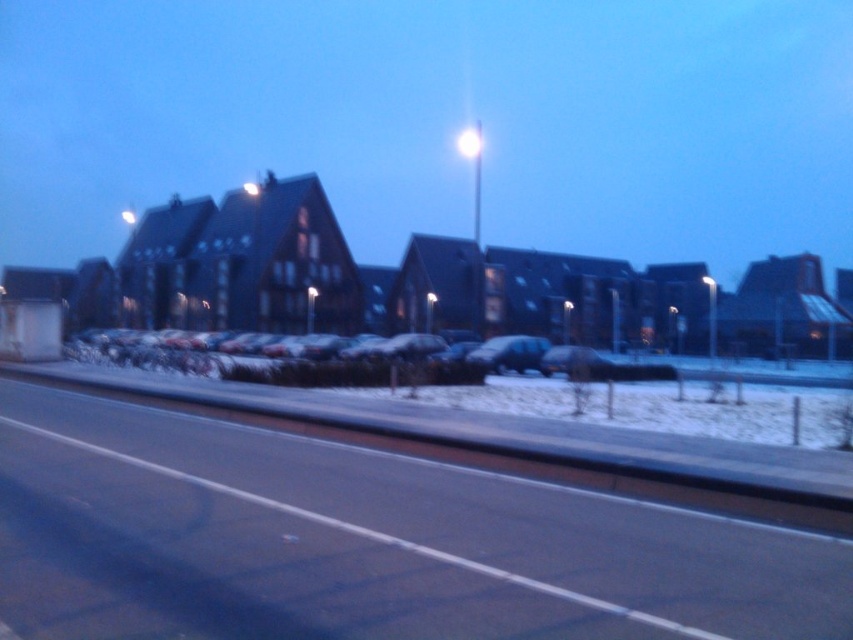
Does smooth concrete street at lower left lie behind snow-covered cars at center?

Yes, smooth concrete street at lower left is behind snow-covered cars at center.

Which of these two, smooth concrete street at lower left or snow-covered cars at center, stands shorter?

Standing shorter between the two is snow-covered cars at center.

Between point (660, 96) and point (410, 348), which one is positioned behind?

Positioned behind is point (660, 96).

Locate an element on the screen. The image size is (853, 640). smooth concrete street at lower left is located at coordinates (438, 120).